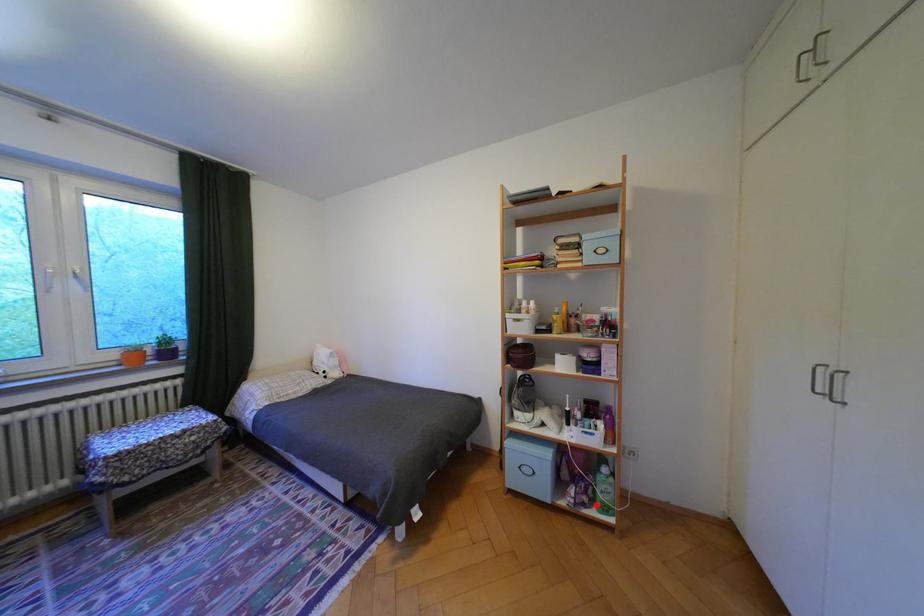
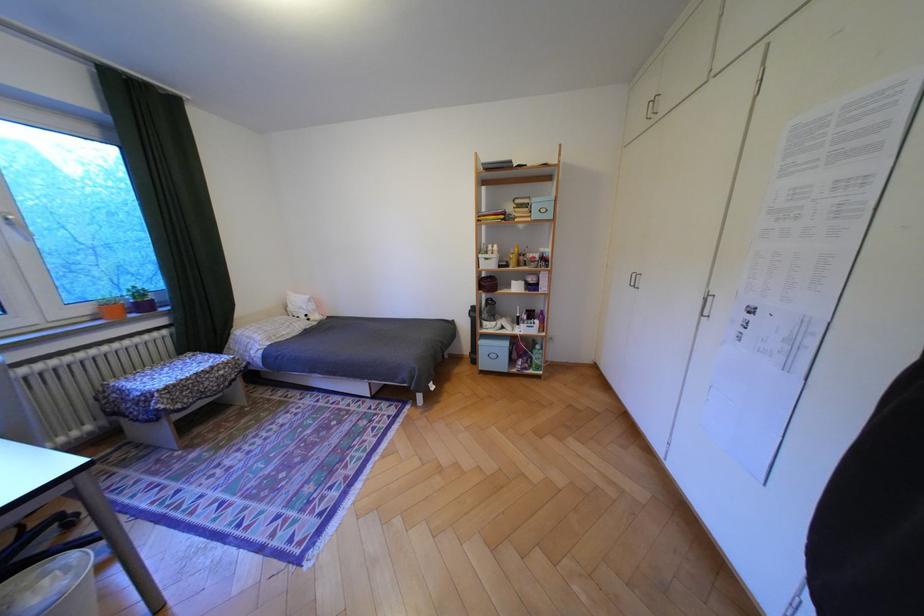
Find the pixel in the second image that matches the highlighted location in the first image.

(538, 369)